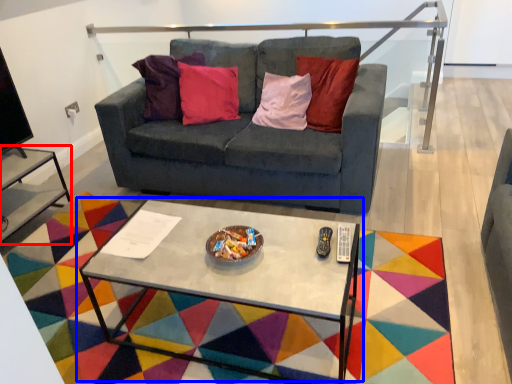
Question: Among these objects, which one is nearest to the camera, side table (highlighted by a red box) or coffee table (highlighted by a blue box)?

Choices:
 (A) side table
 (B) coffee table

Answer: (B)